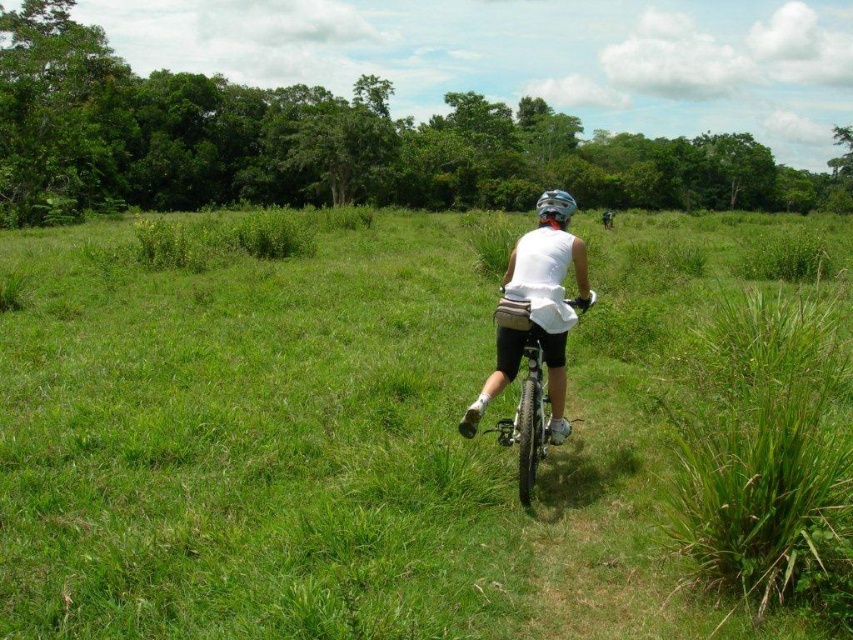
You are a cyclist navigating a grassy field. You need to avoid hitting a tree branch that is hidden in the green grassy at center. Since the white matte helmet at center is in your line of sight, which direction should you steer to avoid the obstacle?

The green grassy at center is to the left of the white matte helmet at center. To avoid the hidden tree branch in the green grassy at center, steer to the right away from the grassy area where the obstacle is located.

You are a drone operator trying to capture a photo of the person riding a bicycle through the grassy field. To ensure the green grassy at center is centered in your shot, where should you position your drone relative to the person?

The green grassy at center is located at point (x=339, y=436). To center it in the shot, position the drone so that the green grassy at center is at the center coordinates of the image.

The person is riding a bicycle through a grassy field. They have a white matte helmet at center and are surrounded by green grassy at center. Which object is positioned lower in the image?

The green grassy at center is positioned below the white matte helmet at center, so the green grassy at center is lower in the image.